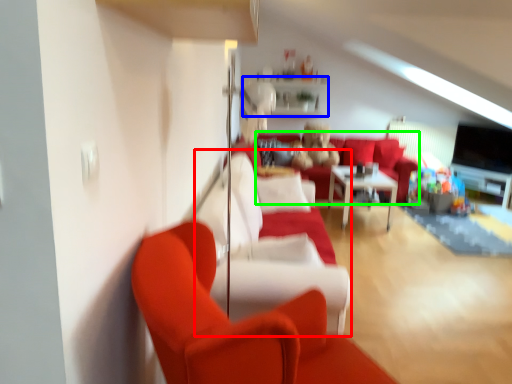
Question: Considering the real-world distances, which object is farthest from couch (highlighted by a red box)? shelf (highlighted by a blue box) or couch (highlighted by a green box)?

Choices:
 (A) shelf
 (B) couch

Answer: (B)